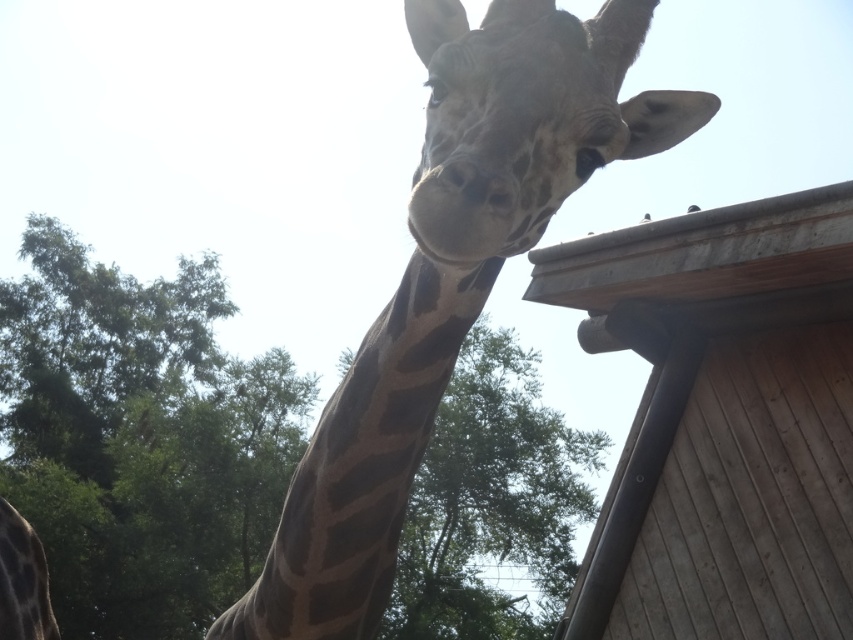
Does green leafy tree at upper left appear on the left side of spotted fur giraffe at center?

Indeed, green leafy tree at upper left is positioned on the left side of spotted fur giraffe at center.

How much distance is there between green leafy tree at upper left and spotted fur giraffe at center?

green leafy tree at upper left is 16.17 meters away from spotted fur giraffe at center.

Where is `green leafy tree at upper left`? This screenshot has height=640, width=853. green leafy tree at upper left is located at coordinates (138, 438).

Who is higher up, green leafy tree at upper left or wooden hut at upper right?

wooden hut at upper right

Does green leafy tree at upper left have a lesser width compared to wooden hut at upper right?

No.

Who is more distant from viewer, (15, 291) or (786, 556)?

The point (15, 291) is more distant.

The width and height of the screenshot is (853, 640). Identify the location of green leafy tree at upper left. (138, 438).

Between wooden hut at upper right and spotted fur giraffe at center, which one is positioned higher?

spotted fur giraffe at center is above.

Who is lower down, wooden hut at upper right or spotted fur giraffe at center?

wooden hut at upper right is below.

Does point (717, 627) lie behind point (419, 456)?

That is True.

Find the location of `wooden hut at upper right`. wooden hut at upper right is located at coordinates (721, 420).